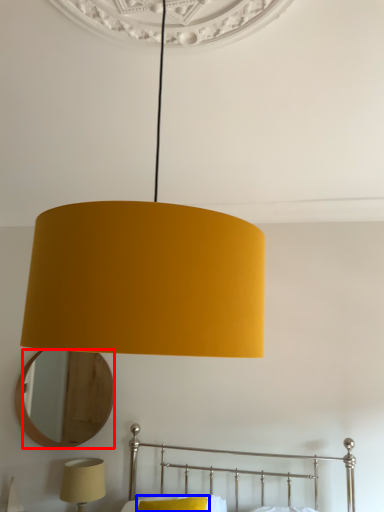
Question: Among these objects, which one is farthest to the camera, mirror (highlighted by a red box) or pillow (highlighted by a blue box)?

Choices:
 (A) mirror
 (B) pillow

Answer: (A)